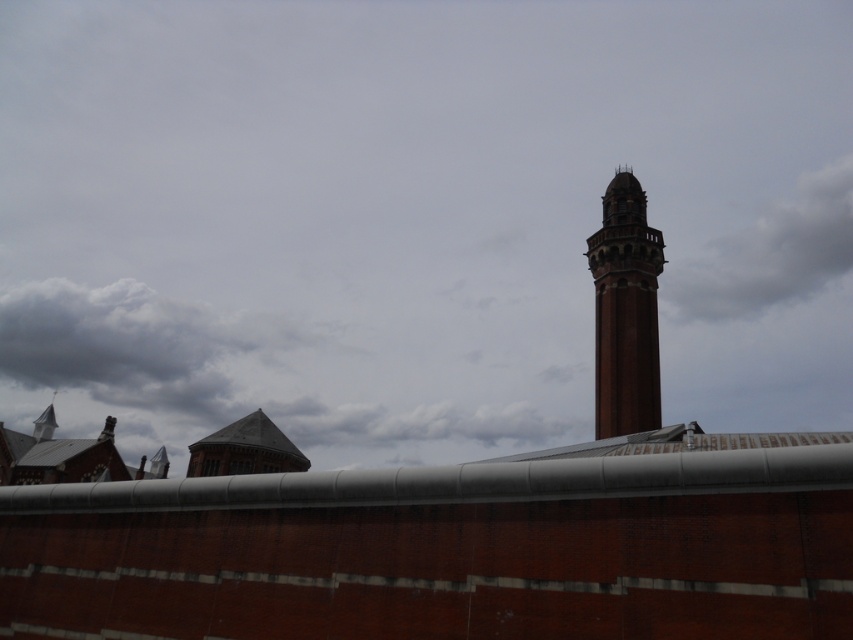
Question: Does gray fluffy cloud at upper right appear on the right side of brick tower at right?

Choices:
 (A) no
 (B) yes

Answer: (B)

Question: Which of the following is the farthest from the observer?

Choices:
 (A) gray fluffy cloud at lower left
 (B) gray fluffy cloud at upper right
 (C) brick tower at right

Answer: (A)

Question: Among these objects, which one is nearest to the camera?

Choices:
 (A) gray fluffy cloud at lower left
 (B) brick tower at right

Answer: (B)

Question: Which point is closer to the camera?

Choices:
 (A) (757, 257)
 (B) (148, 381)
 (C) (656, 324)

Answer: (C)

Question: Can you confirm if gray fluffy cloud at lower left is positioned above gray fluffy cloud at upper right?

Choices:
 (A) no
 (B) yes

Answer: (A)

Question: From the image, what is the correct spatial relationship of gray fluffy cloud at lower left in relation to brick tower at right?

Choices:
 (A) right
 (B) left

Answer: (B)